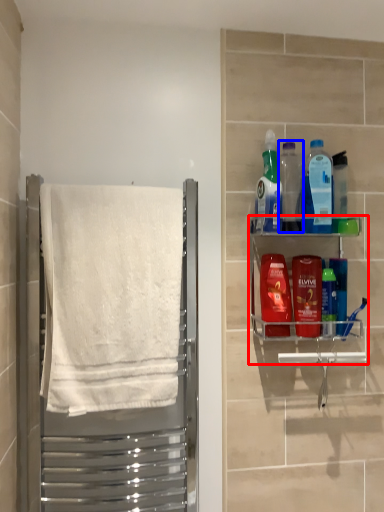
Question: Which point is further to the camera, shelf (highlighted by a red box) or bottle (highlighted by a blue box)?

Choices:
 (A) shelf
 (B) bottle

Answer: (B)